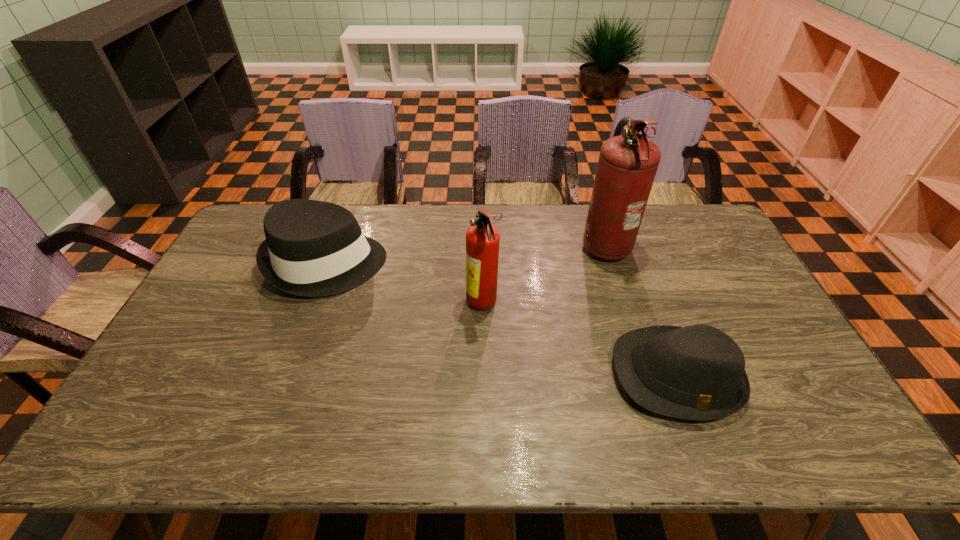
In the image, there is a desktop. What are the coordinates of `vacant space at the far edge` in the screenshot? It's located at tap(660, 209).

The width and height of the screenshot is (960, 540). Find the location of `vacant space at the near edge of the desktop`. vacant space at the near edge of the desktop is located at coordinates [514, 420].

This screenshot has height=540, width=960. In the image, there is a desktop. Find the location of `vacant space at the left edge`. vacant space at the left edge is located at coordinates (190, 321).

The image size is (960, 540). Identify the location of vacant space at the right edge of the desktop. (720, 277).

Where is `vacant space at the far left corner`? The image size is (960, 540). vacant space at the far left corner is located at coordinates (265, 205).

The width and height of the screenshot is (960, 540). I want to click on vacant region at the near left corner of the desktop, so click(x=164, y=421).

I want to click on free space between the nearer fire extinguisher and the shortest object, so click(x=580, y=340).

You are a GUI agent. You are given a task and a screenshot of the screen. Output one action in this format:
    pyautogui.click(x=<x>, y=<y>)
    Task: Click on the free point between the nearest object and the third tallest object
    Image resolution: width=960 pixels, height=540 pixels.
    Given the screenshot: What is the action you would take?
    pyautogui.click(x=501, y=320)

Identify the location of free spot between the farther fire extinguisher and the third object from right to left. The height and width of the screenshot is (540, 960). (543, 274).

Locate an element on the screen. vacant area that lies between the nearest object and the taller fire extinguisher is located at coordinates (640, 309).